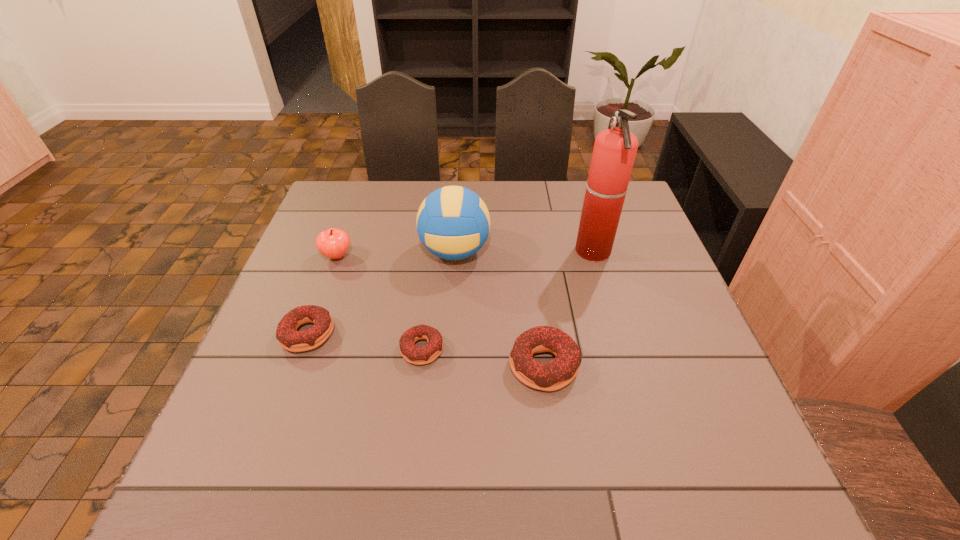
You are a GUI agent. You are given a task and a screenshot of the screen. Output one action in this format:
    pyautogui.click(x=<x>, y=<y>)
    Task: Click on the blank space located 0.250m on the back of the second shortest doughnut
    The image size is (960, 540).
    Given the screenshot: What is the action you would take?
    pyautogui.click(x=339, y=248)

Locate an element on the screen. free space located on the back of the shortest object is located at coordinates (433, 259).

The image size is (960, 540). What are the coordinates of `blank space located 0.380m on the left of the fourth tallest object` in the screenshot? It's located at (332, 365).

Image resolution: width=960 pixels, height=540 pixels. I want to click on vacant space positioned on the front of the volleyball, so click(x=446, y=387).

The image size is (960, 540). Find the location of `vacant space located with the nozzle and gauge on the tallest object`. vacant space located with the nozzle and gauge on the tallest object is located at coordinates (507, 252).

You are a GUI agent. You are given a task and a screenshot of the screen. Output one action in this format:
    pyautogui.click(x=<x>, y=<y>)
    Task: Click on the blank space located 0.100m with the nozzle and gauge on the tallest object
    
    Given the screenshot: What is the action you would take?
    pyautogui.click(x=540, y=252)

Locate an element on the screen. The width and height of the screenshot is (960, 540). blank space located with the nozzle and gauge on the tallest object is located at coordinates (496, 252).

Where is `vacant area situated 0.250m on the back of the fourth shortest object`? The width and height of the screenshot is (960, 540). vacant area situated 0.250m on the back of the fourth shortest object is located at coordinates (358, 198).

Locate an element on the screen. doughnut at the left edge is located at coordinates (289, 338).

In order to click on apple that is at the left edge in this screenshot , I will do [333, 243].